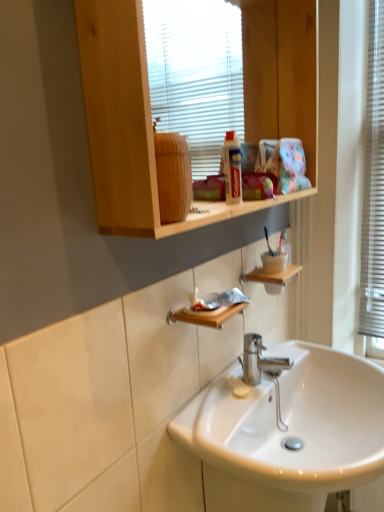
Question: Does wooden shelf at upper center have a lesser width compared to wooden shelf at lower center, the second shelf in the front-to-back sequence?

Choices:
 (A) yes
 (B) no

Answer: (A)

Question: Is wooden shelf at upper center behind wooden shelf at lower center, the first shelf viewed from the top?

Choices:
 (A) yes
 (B) no

Answer: (B)

Question: Is wooden shelf at upper center looking in the opposite direction of wooden shelf at lower center, acting as the second shelf starting from the left?

Choices:
 (A) yes
 (B) no

Answer: (B)

Question: From a real-world perspective, is wooden shelf at upper center on top of wooden shelf at lower center, the second shelf in the front-to-back sequence?

Choices:
 (A) no
 (B) yes

Answer: (B)

Question: Could wooden shelf at lower center, the second shelf in the front-to-back sequence, be considered to be inside wooden shelf at upper center?

Choices:
 (A) yes
 (B) no

Answer: (B)

Question: Considering the positions of white plastic window frame at right and white glossy sink at center in the image, is white plastic window frame at right taller or shorter than white glossy sink at center?

Choices:
 (A) short
 (B) tall

Answer: (B)

Question: Is white plastic window frame at right in front of or behind white glossy sink at center in the image?

Choices:
 (A) front
 (B) behind

Answer: (B)

Question: Is white plastic window frame at right inside or outside of white glossy sink at center?

Choices:
 (A) outside
 (B) inside

Answer: (A)

Question: Is white plastic window frame at right bigger or smaller than white glossy sink at center?

Choices:
 (A) small
 (B) big

Answer: (A)

Question: From the image's perspective, is wooden soap dish at lower center, the 2th shelf when ordered from right to left, above or below white plastic window frame at right?

Choices:
 (A) above
 (B) below

Answer: (B)

Question: Is wooden soap dish at lower center, the first shelf viewed from the front, to the left or to the right of white plastic window frame at right in the image?

Choices:
 (A) left
 (B) right

Answer: (A)

Question: Considering the positions of wooden soap dish at lower center, the 1th shelf in the left-to-right sequence, and white plastic window frame at right in the image, is wooden soap dish at lower center, the 1th shelf in the left-to-right sequence, bigger or smaller than white plastic window frame at right?

Choices:
 (A) big
 (B) small

Answer: (B)

Question: From a real-world perspective, is wooden soap dish at lower center, positioned as the second shelf in top-to-bottom order, positioned above or below white plastic window frame at right?

Choices:
 (A) above
 (B) below

Answer: (B)

Question: Which is correct: white glossy sink at center is inside wooden soap dish at lower center, positioned as the second shelf in top-to-bottom order, or outside of it?

Choices:
 (A) inside
 (B) outside

Answer: (B)

Question: From the image's perspective, is white glossy sink at center located above or below wooden soap dish at lower center, the first shelf viewed from the front?

Choices:
 (A) above
 (B) below

Answer: (B)